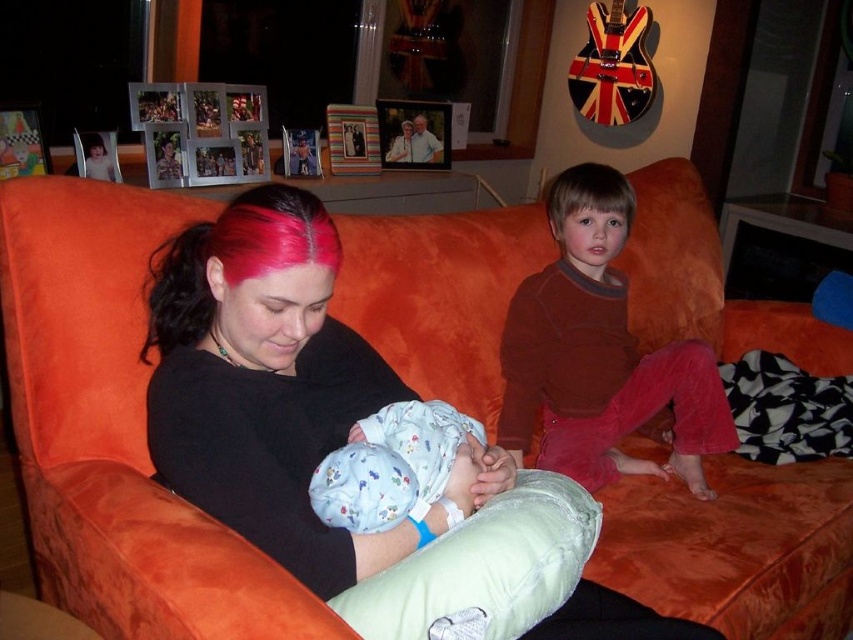
Who is more distant from viewer, [154,257] or [381,483]?

The point [154,257] is behind.

Is point (149, 321) more distant than point (387, 461)?

Yes, it is behind point (387, 461).

Is point (256, 209) less distant than point (368, 472)?

That is True.

This screenshot has width=853, height=640. Find the location of `pink matte hair at center`. pink matte hair at center is located at coordinates (231, 259).

Which is more to the right, velvet orange couch at right or pink matte hair at center?

Positioned to the right is velvet orange couch at right.

Describe the element at coordinates (599, 353) in the screenshot. This screenshot has width=853, height=640. I see `velvet orange couch at right` at that location.

You are a GUI agent. You are given a task and a screenshot of the screen. Output one action in this format:
    pyautogui.click(x=<x>, y=<y>)
    Task: Click on the velvet orange couch at right
    
    Given the screenshot: What is the action you would take?
    pyautogui.click(x=599, y=353)

Who is taller, orange velvet couch at center or velvet orange couch at right?

velvet orange couch at right

Is orange velvet couch at center to the left of velvet orange couch at right from the viewer's perspective?

Incorrect, orange velvet couch at center is not on the left side of velvet orange couch at right.

Which is in front, point (650, 531) or point (563, 342)?

Point (650, 531) is in front.

Where is `orange velvet couch at center`? Image resolution: width=853 pixels, height=640 pixels. orange velvet couch at center is located at coordinates pyautogui.click(x=115, y=429).